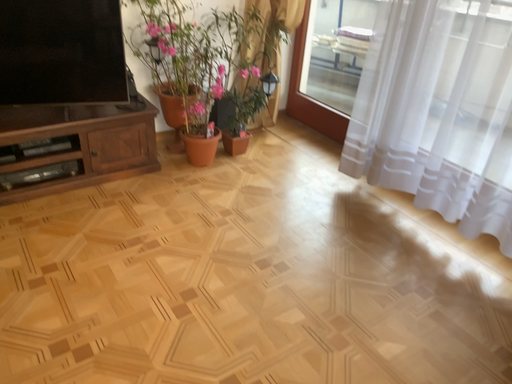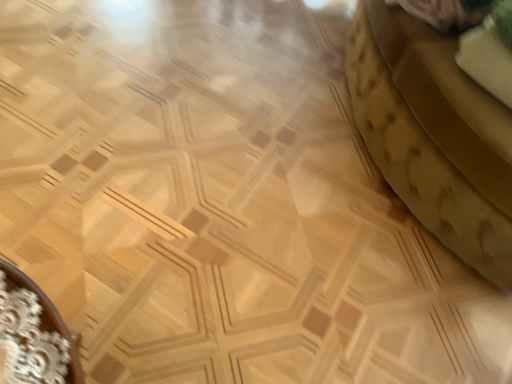
Question: How did the camera likely rotate when shooting the video?

Choices:
 (A) rotated upward
 (B) rotated downward

Answer: (B)